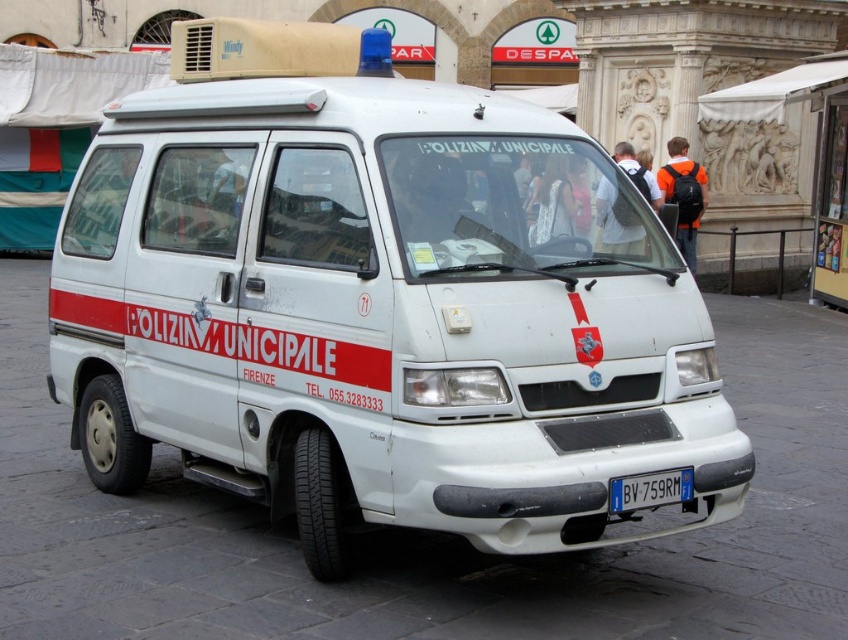
Question: Is white matte van at center to the left of blue metallic license plate at front from the viewer's perspective?

Choices:
 (A) no
 (B) yes

Answer: (B)

Question: Is white matte van at center above blue metallic license plate at front?

Choices:
 (A) yes
 (B) no

Answer: (A)

Question: Is the position of white matte van at center more distant than that of blue metallic license plate at front?

Choices:
 (A) no
 (B) yes

Answer: (A)